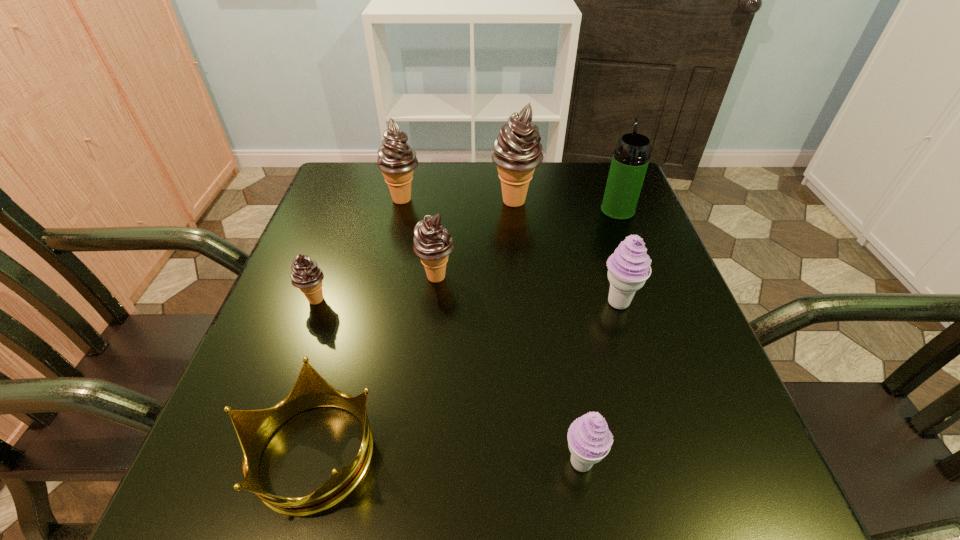
Identify the location of the rightmost chocolate icecream. (517, 152).

The height and width of the screenshot is (540, 960). What are the coordinates of `the tallest icecream` in the screenshot? It's located at (517, 152).

What are the coordinates of `thermos bottle` in the screenshot? It's located at (630, 160).

Identify the location of the fifth shortest icecream. The height and width of the screenshot is (540, 960). (396, 159).

I want to click on the third chocolate icecream from right to left, so pos(396,159).

Where is `the third chocolate icecream from left to right`? the third chocolate icecream from left to right is located at coordinates (432, 243).

Where is `the third biggest chocolate icecream`? This screenshot has width=960, height=540. the third biggest chocolate icecream is located at coordinates (432, 243).

Image resolution: width=960 pixels, height=540 pixels. What are the coordinates of `the farther purple icecream` in the screenshot? It's located at (629, 267).

Find the location of `the bigger purple icecream`. the bigger purple icecream is located at coordinates (629, 267).

At what (x,y) coordinates should I click in order to perform the action: click on the smaller purple icecream. Please return your answer as a coordinate pair (x, y). The image size is (960, 540). Looking at the image, I should click on (589, 439).